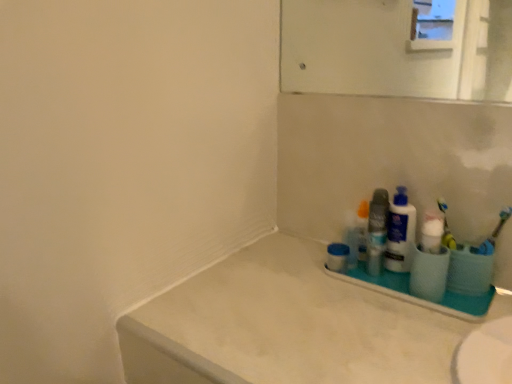
This screenshot has height=384, width=512. Find the location of `free spot to the right of blue matte jar at right`. free spot to the right of blue matte jar at right is located at coordinates (409, 286).